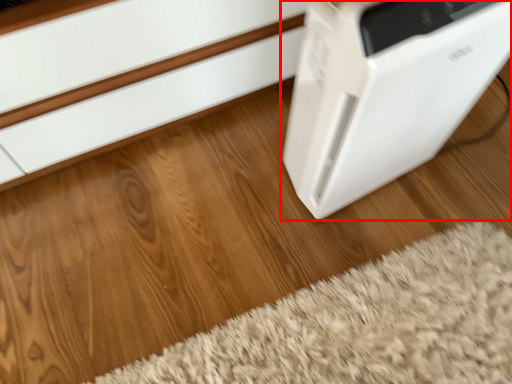
Question: Considering the relative positions of home appliance (annotated by the red box) and doormat in the image provided, where is home appliance (annotated by the red box) located with respect to the staircase?

Choices:
 (A) left
 (B) right

Answer: (B)